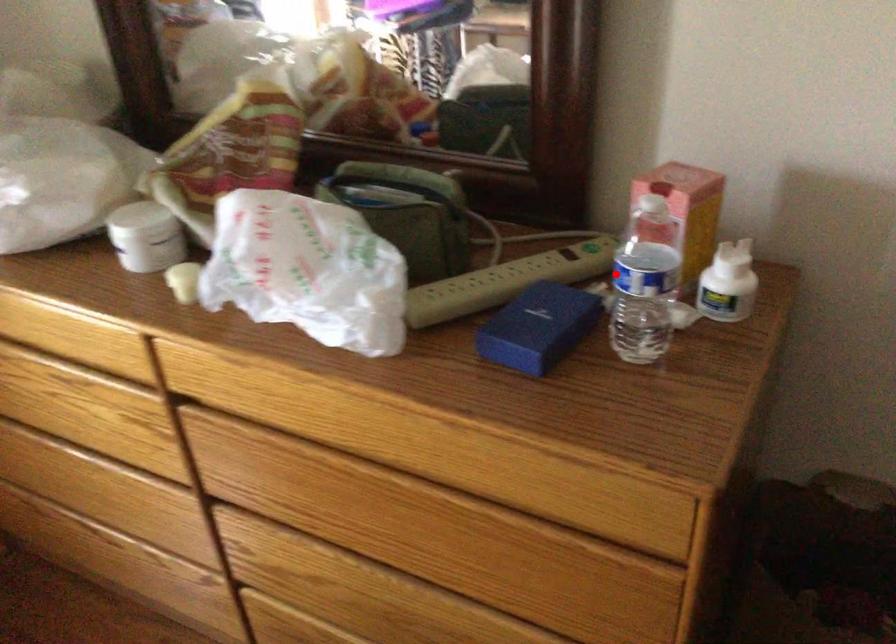
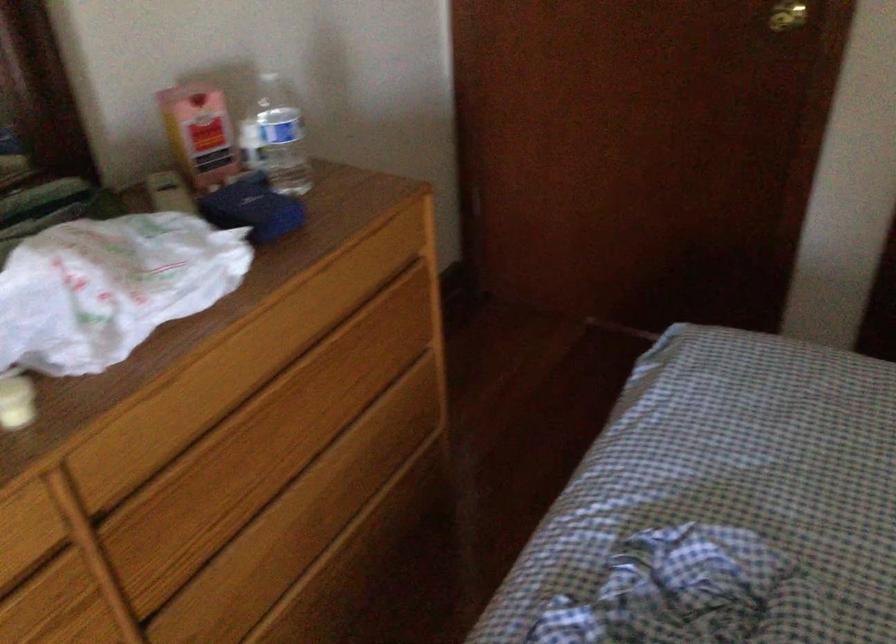
Find the pixel in the second image that matches the highlighted location in the first image.

(276, 138)